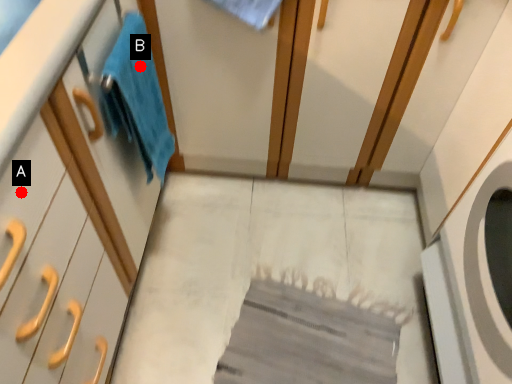
Question: Two points are circled on the image, labeled by A and B beside each circle. Which point is further to the camera?

Choices:
 (A) A is further
 (B) B is further

Answer: (B)